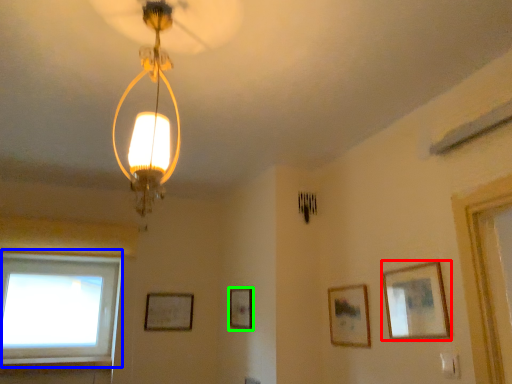
Question: Which is nearer to the picture frame (highlighted by a red box)? window (highlighted by a blue box) or picture frame (highlighted by a green box).

Choices:
 (A) window
 (B) picture frame

Answer: (B)